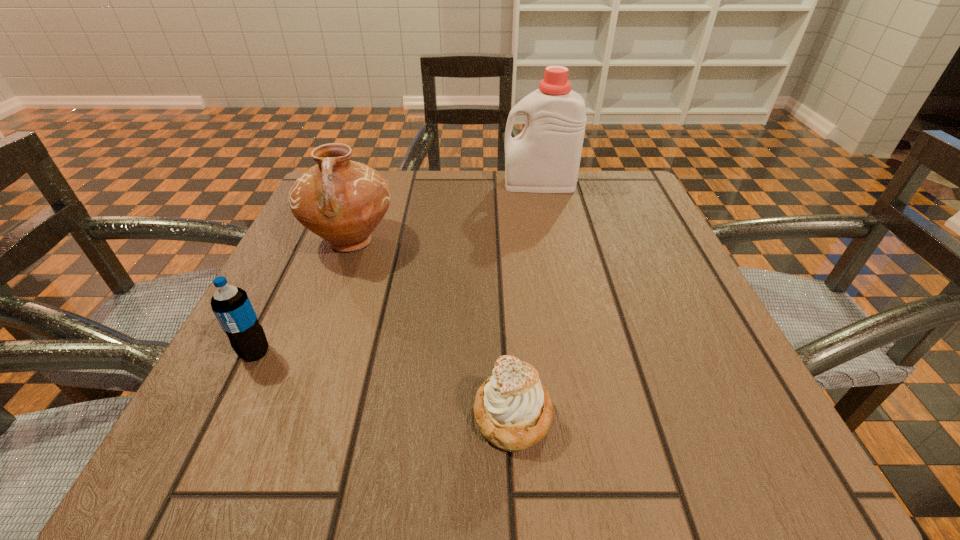
Image resolution: width=960 pixels, height=540 pixels. I want to click on the tallest object, so click(x=545, y=157).

Locate an element on the screen. Image resolution: width=960 pixels, height=540 pixels. detergent is located at coordinates (545, 157).

This screenshot has width=960, height=540. Find the location of `the third nearest object`. the third nearest object is located at coordinates (342, 201).

Find the location of a particular element. The image size is (960, 540). the second tallest object is located at coordinates (342, 201).

Locate an element on the screen. The image size is (960, 540). soda bottle is located at coordinates (231, 305).

Identify the location of the third farthest object. (231, 305).

The image size is (960, 540). What are the coordinates of `pastry` in the screenshot? It's located at (513, 410).

You are a GUI agent. You are given a task and a screenshot of the screen. Output one action in this format:
    pyautogui.click(x=<x>, y=<y>)
    Task: Click on the shortest object
    
    Given the screenshot: What is the action you would take?
    point(513,410)

Identify the location of vacant space located 0.400m on the handle side of the tallest object. (333, 184).

Locate an element on the screen. vacant area situated 0.390m on the handle side of the tallest object is located at coordinates (338, 184).